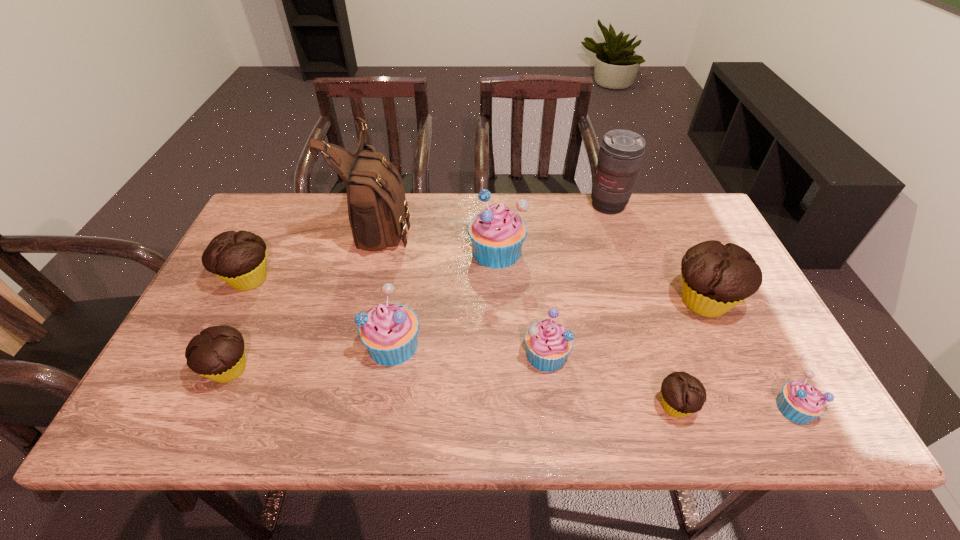
Where is `unoccupied position between the second biggest chocolate muffin and the farthest blue muffin`? unoccupied position between the second biggest chocolate muffin and the farthest blue muffin is located at coordinates (372, 265).

Find the location of a particular element. Image resolution: width=960 pixels, height=540 pixels. blank region between the third smallest chocolate muffin and the third muffin from left to right is located at coordinates (321, 312).

This screenshot has height=540, width=960. I want to click on free space between the farthest blue muffin and the third smallest chocolate muffin, so 372,265.

Identify which object is the third nearest to the sixth muffin from left to right. Please provide its 2D coordinates. Your answer should be formatted as a tuple, i.e. [(x, y)], where the tuple contains the x and y coordinates of a point satisfying the conditions above.

[(800, 402)]

This screenshot has height=540, width=960. I want to click on the third closest object relative to the brown shoulder bag, so click(389, 331).

Identify the location of muffin object that ranks as the seventh closest to the rightmost blue muffin. The height and width of the screenshot is (540, 960). (239, 258).

At what (x,y) coordinates should I click in order to perform the action: click on muffin that is the third closest one to the third biggest chocolate muffin. Please return your answer as a coordinate pair (x, y). The height and width of the screenshot is (540, 960). Looking at the image, I should click on (497, 234).

Select which blue muffin is the second closest to the shoulder bag. Please provide its 2D coordinates. Your answer should be formatted as a tuple, i.e. [(x, y)], where the tuple contains the x and y coordinates of a point satisfying the conditions above.

[(389, 331)]

Point out which blue muffin is positioned as the third nearest to the rightmost chocolate muffin. Please provide its 2D coordinates. Your answer should be formatted as a tuple, i.e. [(x, y)], where the tuple contains the x and y coordinates of a point satisfying the conditions above.

[(497, 234)]

Where is `the third closest chocolate muffin relative to the second smallest chocolate muffin`? The height and width of the screenshot is (540, 960). the third closest chocolate muffin relative to the second smallest chocolate muffin is located at coordinates (715, 278).